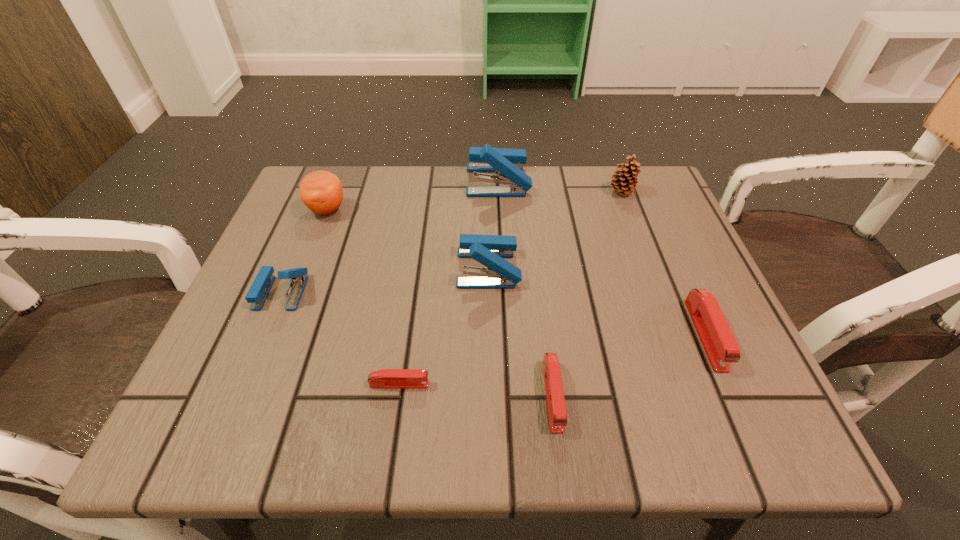
Where is `vacant space in between the second object from right to left and the farthest stapler`? Image resolution: width=960 pixels, height=540 pixels. vacant space in between the second object from right to left and the farthest stapler is located at coordinates (560, 186).

You are a GUI agent. You are given a task and a screenshot of the screen. Output one action in this format:
    pyautogui.click(x=<x>, y=<y>)
    Task: Click on the free spot between the fifth tallest stapler and the orange orange
    
    Given the screenshot: What is the action you would take?
    pyautogui.click(x=440, y=303)

The width and height of the screenshot is (960, 540). What are the coordinates of `unoccupied area between the farthest blue stapler and the second object from right to left` in the screenshot? It's located at (560, 186).

In order to click on empty space between the third shortest stapler and the second shortest object in this screenshot , I will do `click(629, 365)`.

Locate an element on the screen. unoccupied area between the biggest blue stapler and the orange orange is located at coordinates (412, 195).

Find the location of a particular element. The image size is (960, 540). object that is the closest one to the second object from right to left is located at coordinates (508, 163).

Where is `the seventh closest object to the second biggest blue stapler`? The image size is (960, 540). the seventh closest object to the second biggest blue stapler is located at coordinates point(718,341).

I want to click on stapler identified as the second closest to the pinecone, so click(x=489, y=250).

This screenshot has width=960, height=540. Find the location of `the closest stapler to the tallest stapler`. the closest stapler to the tallest stapler is located at coordinates (489, 250).

Locate an element on the screen. The height and width of the screenshot is (540, 960). blue stapler identified as the second closest to the biggest blue stapler is located at coordinates (261, 286).